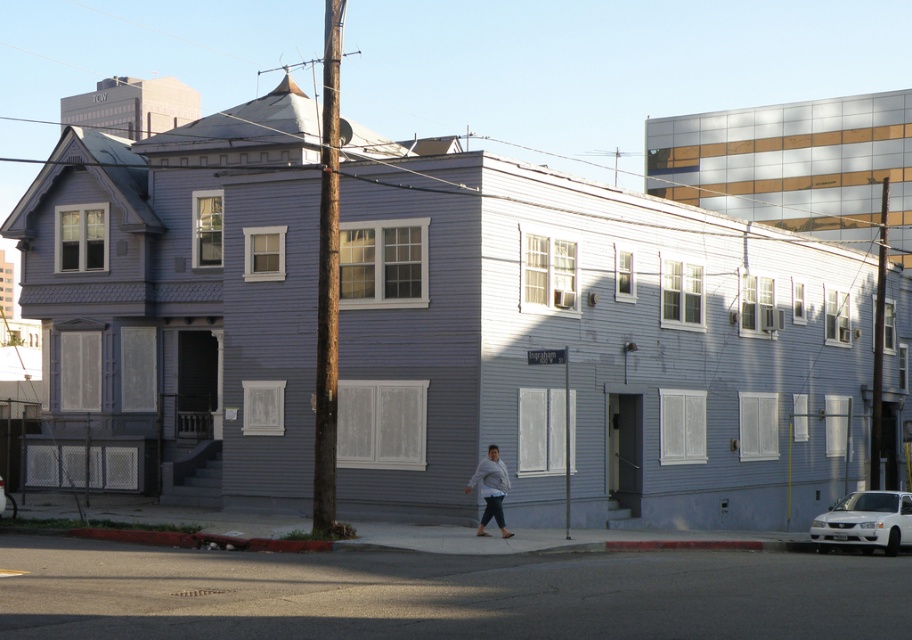
Question: Which object is positioned closest to the white glossy sedan at lower right?

Choices:
 (A) gray sweater at lower center
 (B) white glossy car at lower right

Answer: (A)

Question: Which point appears closest to the camera in this image?

Choices:
 (A) (492, 506)
 (B) (841, 524)

Answer: (A)

Question: Is gray sweater at lower center thinner than white glossy car at lower right?

Choices:
 (A) no
 (B) yes

Answer: (B)

Question: Is white glossy sedan at lower right above white glossy car at lower right?

Choices:
 (A) yes
 (B) no

Answer: (B)

Question: Which point is farther to the camera?

Choices:
 (A) white glossy sedan at lower right
 (B) white glossy car at lower right
 (C) gray sweater at lower center

Answer: (A)

Question: Can you confirm if white glossy sedan at lower right is positioned below gray sweater at lower center?

Choices:
 (A) no
 (B) yes

Answer: (B)